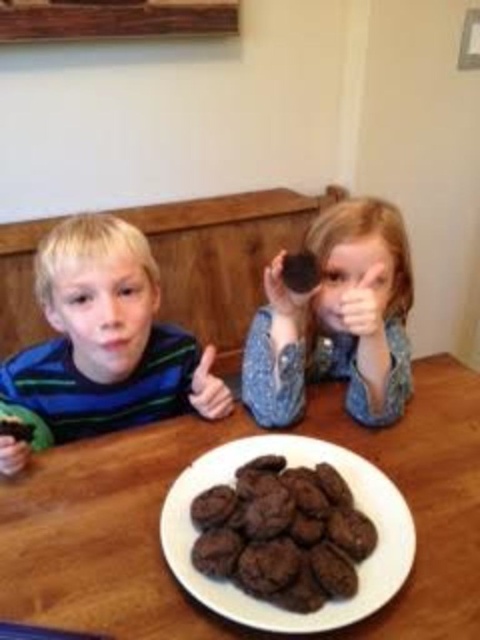
Question: Which object is positioned closest to the white matte plate at center?

Choices:
 (A) matte brown cookie at upper right
 (B) matte plastic hand at lower left
 (C) wooden table at center

Answer: (C)

Question: Does white matte plate at center appear under matte black cookie at upper center?

Choices:
 (A) no
 (B) yes

Answer: (B)

Question: Can you confirm if matte blue shirt at left is positioned to the right of matte plastic hand at lower left?

Choices:
 (A) no
 (B) yes

Answer: (B)

Question: Among these objects, which one is farthest from the camera?

Choices:
 (A) matte brown cookie at upper right
 (B) matte black cookie at upper center
 (C) wooden table at center
 (D) white matte plate at center

Answer: (B)

Question: Which of the following is the farthest from the observer?

Choices:
 (A) (348, 292)
 (B) (356, 630)
 (C) (307, 282)

Answer: (C)

Question: Can you confirm if wooden table at center is positioned above matte plastic hand at lower left?

Choices:
 (A) no
 (B) yes

Answer: (A)